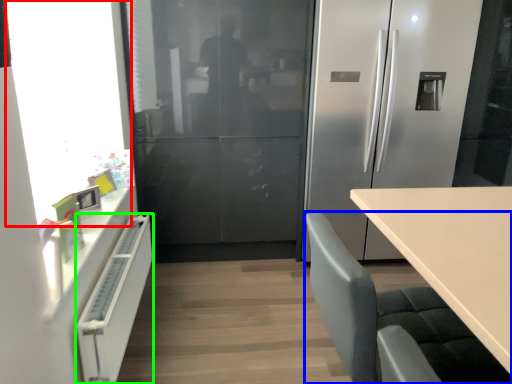
Question: Based on their relative distances, which object is farther from window screen (highlighted by a red box)? Choose from chair (highlighted by a blue box) and cabinetry (highlighted by a green box).

Choices:
 (A) chair
 (B) cabinetry

Answer: (A)